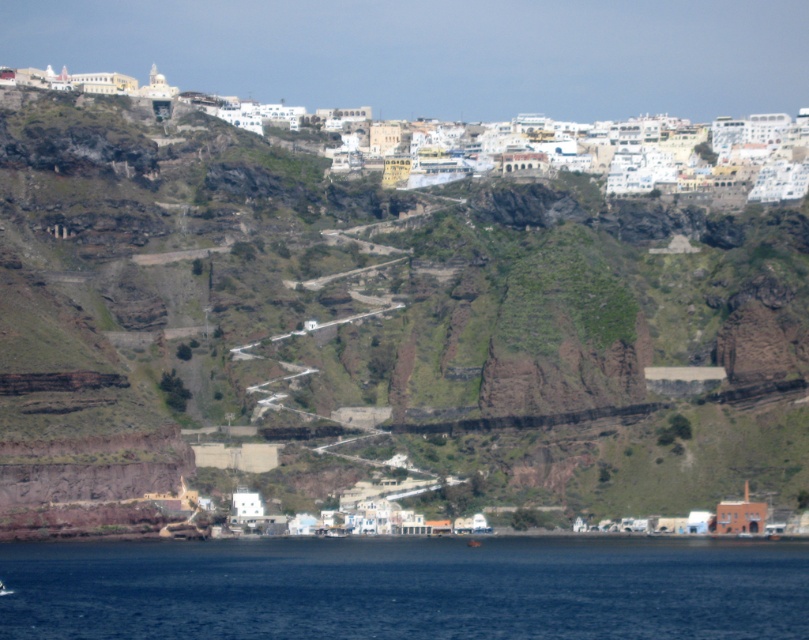
Question: Does dark blue water at lower center have a smaller size compared to white stone buildings at upper center?

Choices:
 (A) no
 (B) yes

Answer: (B)

Question: Does dark blue water at lower center appear on the right side of white stone buildings at upper center?

Choices:
 (A) yes
 (B) no

Answer: (A)

Question: Which of these objects is positioned farthest from the white stone buildings at upper center?

Choices:
 (A) dark blue water at lower center
 (B) brown rock at center

Answer: (A)

Question: Which of the following is the closest to the observer?

Choices:
 (A) (107, 634)
 (B) (388, 221)

Answer: (A)

Question: Is brown rock at center wider than dark blue water at lower center?

Choices:
 (A) yes
 (B) no

Answer: (A)

Question: Which point is closer to the camera?

Choices:
 (A) (138, 486)
 (B) (183, 609)

Answer: (B)